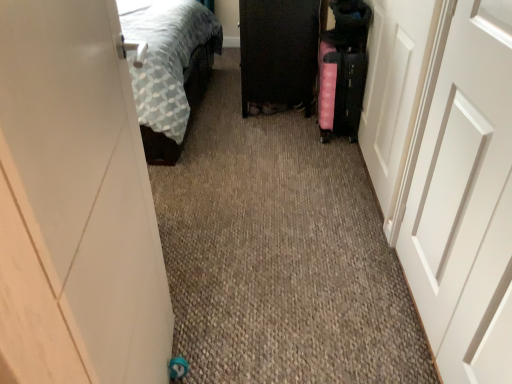
Question: Is pink fabric suitcase at right far away from black glossy cabinet at center?

Choices:
 (A) no
 (B) yes

Answer: (A)

Question: Can you confirm if pink fabric suitcase at right is wider than black glossy cabinet at center?

Choices:
 (A) yes
 (B) no

Answer: (B)

Question: Is pink fabric suitcase at right surrounding black glossy cabinet at center?

Choices:
 (A) no
 (B) yes

Answer: (A)

Question: Does pink fabric suitcase at right touch black glossy cabinet at center?

Choices:
 (A) yes
 (B) no

Answer: (B)

Question: From a real-world perspective, is pink fabric suitcase at right positioned under black glossy cabinet at center based on gravity?

Choices:
 (A) yes
 (B) no

Answer: (A)

Question: Is point (412, 31) closer or farther from the camera than point (352, 67)?

Choices:
 (A) farther
 (B) closer

Answer: (B)

Question: In the image, is white glossy door at right, which appears as the 1th door when viewed from the right, positioned in front of or behind pink fabric suitcase at right?

Choices:
 (A) front
 (B) behind

Answer: (A)

Question: Considering the positions of white glossy door at right, which appears as the 1th door when viewed from the right, and pink fabric suitcase at right in the image, is white glossy door at right, which appears as the 1th door when viewed from the right, bigger or smaller than pink fabric suitcase at right?

Choices:
 (A) small
 (B) big

Answer: (B)

Question: Looking at their shapes, would you say white glossy door at right, which appears as the 1th door when viewed from the right, is wider or thinner than pink fabric suitcase at right?

Choices:
 (A) wide
 (B) thin

Answer: (B)

Question: From the image's perspective, relative to black glossy cabinet at center, is white glossy door at left, which is the first door in left-to-right order, above or below?

Choices:
 (A) above
 (B) below

Answer: (B)

Question: From a real-world perspective, is white glossy door at left, which is the first door in left-to-right order, physically located above or below black glossy cabinet at center?

Choices:
 (A) above
 (B) below

Answer: (A)

Question: Considering their positions, is white glossy door at left, which is the first door in left-to-right order, located in front of or behind black glossy cabinet at center?

Choices:
 (A) behind
 (B) front

Answer: (B)

Question: Based on their sizes in the image, would you say white glossy door at left, which is the first door in left-to-right order, is bigger or smaller than black glossy cabinet at center?

Choices:
 (A) small
 (B) big

Answer: (A)

Question: Does point (373, 72) appear closer or farther from the camera than point (424, 112)?

Choices:
 (A) farther
 (B) closer

Answer: (A)

Question: Based on their sizes in the image, would you say white glossy door at right, which is the third door from left to right, is bigger or smaller than white matte door at right, arranged as the 2th door when viewed from the right?

Choices:
 (A) big
 (B) small

Answer: (A)